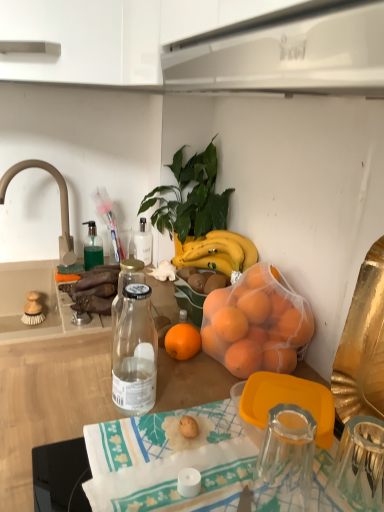
Question: From the image's perspective, is transparent glass coffee cup at center on top of printed fabric tablecloth at center?

Choices:
 (A) no
 (B) yes

Answer: (B)

Question: Would you say transparent glass coffee cup at center is outside printed fabric tablecloth at center?

Choices:
 (A) yes
 (B) no

Answer: (A)

Question: Is transparent glass coffee cup at center beside printed fabric tablecloth at center?

Choices:
 (A) yes
 (B) no

Answer: (B)

Question: Is transparent glass coffee cup at center turned away from printed fabric tablecloth at center?

Choices:
 (A) yes
 (B) no

Answer: (B)

Question: Is printed fabric tablecloth at center located within transparent glass coffee cup at center?

Choices:
 (A) no
 (B) yes

Answer: (A)

Question: Is transparent glass coffee cup at center taller than printed fabric tablecloth at center?

Choices:
 (A) yes
 (B) no

Answer: (A)

Question: Is white glossy range hood at upper center facing away from printed fabric tablecloth at center?

Choices:
 (A) yes
 (B) no

Answer: (B)

Question: Is white glossy range hood at upper center closer to camera compared to printed fabric tablecloth at center?

Choices:
 (A) yes
 (B) no

Answer: (A)

Question: Considering the relative positions of white glossy range hood at upper center and printed fabric tablecloth at center in the image provided, is white glossy range hood at upper center to the right of printed fabric tablecloth at center from the viewer's perspective?

Choices:
 (A) yes
 (B) no

Answer: (A)

Question: Is white glossy range hood at upper center thinner than printed fabric tablecloth at center?

Choices:
 (A) yes
 (B) no

Answer: (A)

Question: Is white glossy range hood at upper center surrounding printed fabric tablecloth at center?

Choices:
 (A) no
 (B) yes

Answer: (A)

Question: From a real-world perspective, is white glossy range hood at upper center located beneath printed fabric tablecloth at center?

Choices:
 (A) no
 (B) yes

Answer: (A)

Question: Is beige matte faucet at upper left in front of orange mesh bag at center?

Choices:
 (A) no
 (B) yes

Answer: (A)